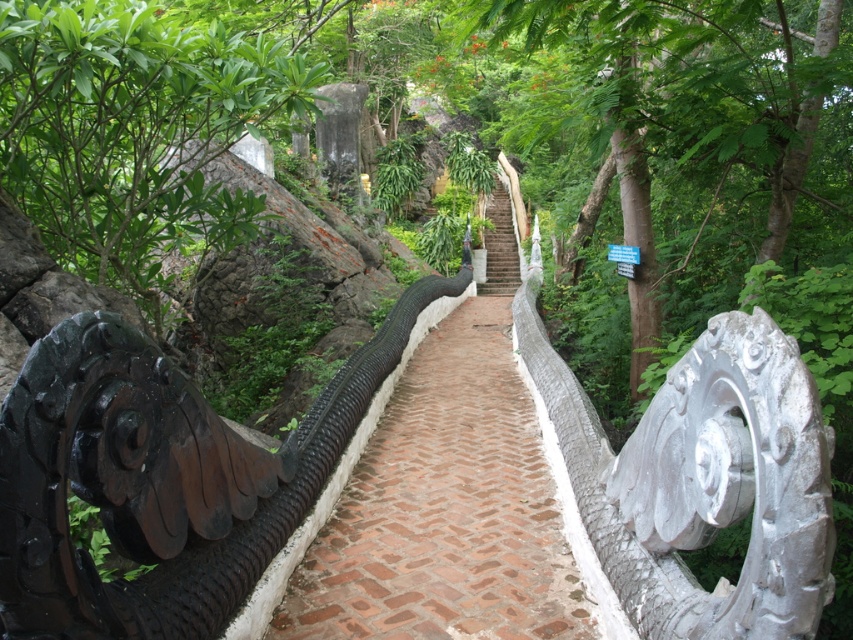
Question: Among these objects, which one is nearest to the camera?

Choices:
 (A) white stone stairs at center
 (B) green leafy tree at left
 (C) green leafy tree at center
 (D) brick paved path at center

Answer: (D)

Question: Which of the following is the closest to the observer?

Choices:
 (A) green leafy tree at left
 (B) white stone stairs at center
 (C) green leafy tree at center

Answer: (A)

Question: Can you confirm if brick paved path at center is bigger than white stone stairs at center?

Choices:
 (A) no
 (B) yes

Answer: (A)

Question: Which object is the closest to the brick paved path at center?

Choices:
 (A) green leafy tree at left
 (B) white stone stairs at center
 (C) green leafy tree at center

Answer: (C)

Question: Is brick paved path at center further to camera compared to white stone stairs at center?

Choices:
 (A) no
 (B) yes

Answer: (A)

Question: Observing the image, what is the correct spatial positioning of green leafy tree at left in reference to white stone stairs at center?

Choices:
 (A) above
 (B) below

Answer: (B)